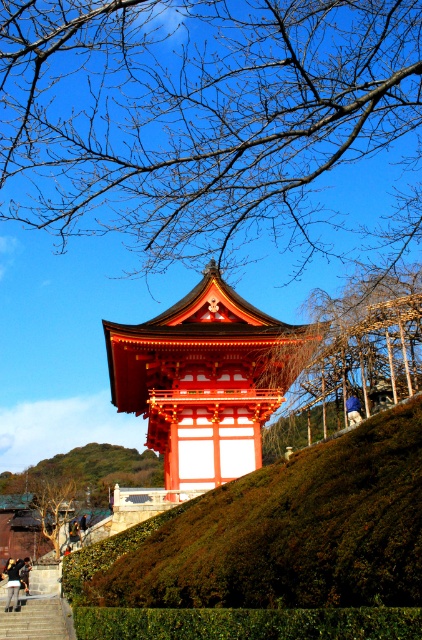
You are standing at the entrance of the traditional Japanese pagoda and notice a point marked at coordinates (91,470) on your map. What object does this point indicate?

The point at (91,470) indicates the green leafy tree at lower left.

You are standing at the entrance of the garden and want to locate the shiny red wood tower at center. According to the coordinates provided, where would you find it?

The shiny red wood tower at center is located at point (205, 380).